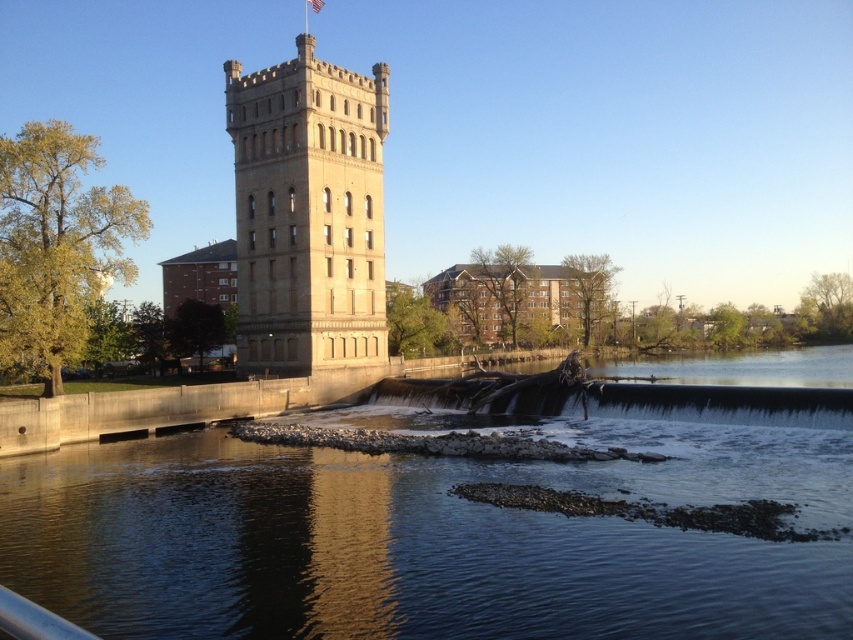
You are a tourist standing at the edge of the river and want to take a photo of the beige stone tower at center. However, there is a metallic gray rail at lower left in your way. Can you move to the side to avoid it and still see the tower?

The metallic gray rail at lower left is behind the beige stone tower at center, so you can move to the side and still see the tower without the rail blocking your view.

You are a photographer standing at the lower left corner of the scene. You want to capture both the beige stone tower at center and the metallic gray rail at lower left in a single shot. Which object will appear larger in your photo?

The beige stone tower at center will appear larger in the photo because it is taller than the metallic gray rail at lower left.